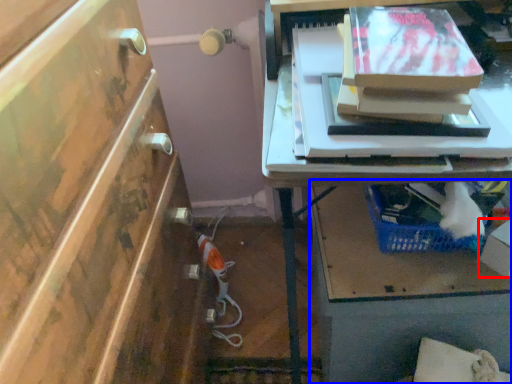
Question: Among these objects, which one is farthest to the camera, box (highlighted by a red box) or vanity (highlighted by a blue box)?

Choices:
 (A) box
 (B) vanity

Answer: (B)